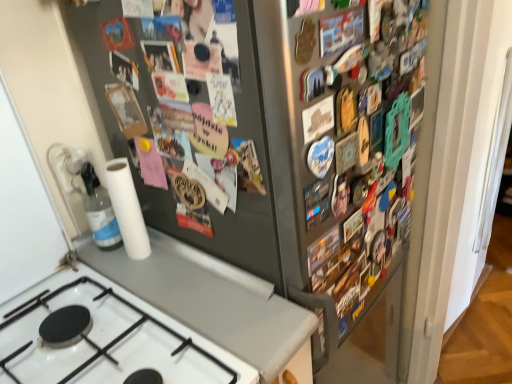
Question: Which direction should I rotate to face metallic button at upper center, marked as the first button in a bottom-to-top arrangement, — up or down?

Choices:
 (A) down
 (B) up

Answer: (B)

Question: From a real-world perspective, is metallic button at upper center, the 2th button when ordered from right to left, beneath metallic gray refrigerator at left?

Choices:
 (A) yes
 (B) no

Answer: (B)

Question: Is metallic button at upper center, which is the second button in left-to-right order, thinner than metallic gray refrigerator at left?

Choices:
 (A) no
 (B) yes

Answer: (B)

Question: Is metallic gray refrigerator at left surrounded by metallic button at upper center, which is the second button in left-to-right order?

Choices:
 (A) no
 (B) yes

Answer: (A)

Question: Is metallic button at upper center, which is the second button in left-to-right order, wider than metallic gray refrigerator at left?

Choices:
 (A) no
 (B) yes

Answer: (A)

Question: Is metallic button at upper center, which is the 3th button in top-to-bottom order, next to metallic gray refrigerator at left?

Choices:
 (A) no
 (B) yes

Answer: (A)

Question: Is metallic button at upper center, marked as the first button in a bottom-to-top arrangement, not inside metallic gray refrigerator at left?

Choices:
 (A) no
 (B) yes

Answer: (B)

Question: Considering the relative sizes of matte plastic photo frame at upper center, which is counted as the 2th button, starting from the bottom, and white glossy gas stove at lower left in the image provided, is matte plastic photo frame at upper center, which is counted as the 2th button, starting from the bottom, taller than white glossy gas stove at lower left?

Choices:
 (A) no
 (B) yes

Answer: (A)

Question: Would you say white glossy gas stove at lower left is part of matte plastic photo frame at upper center, which is the third button from right to left,'s contents?

Choices:
 (A) no
 (B) yes

Answer: (A)

Question: From the image's perspective, is matte plastic photo frame at upper center, which is counted as the 2th button, starting from the bottom, on top of white glossy gas stove at lower left?

Choices:
 (A) no
 (B) yes

Answer: (B)

Question: Is matte plastic photo frame at upper center, the 1th button viewed from the left, oriented away from white glossy gas stove at lower left?

Choices:
 (A) yes
 (B) no

Answer: (B)

Question: Does matte plastic photo frame at upper center, which is the third button from right to left, have a larger size compared to white glossy gas stove at lower left?

Choices:
 (A) no
 (B) yes

Answer: (A)

Question: Is matte plastic photo frame at upper center, the 1th button viewed from the left, positioned far away from white glossy gas stove at lower left?

Choices:
 (A) yes
 (B) no

Answer: (B)

Question: From a real-world perspective, is metallic gray refrigerator at left over transparent plastic bottle at lower left?

Choices:
 (A) yes
 (B) no

Answer: (A)